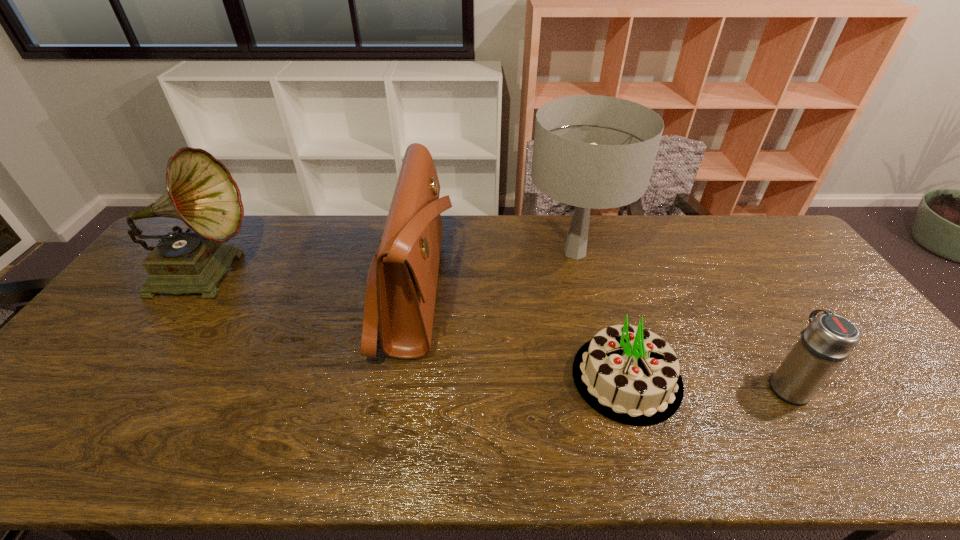
Where is `vacant area situated 0.370m with a handle on the side of the rightmost object`? This screenshot has height=540, width=960. vacant area situated 0.370m with a handle on the side of the rightmost object is located at coordinates (718, 272).

Locate an element on the screen. vacant region located 0.150m with a handle on the side of the rightmost object is located at coordinates (749, 323).

This screenshot has height=540, width=960. What are the coordinates of `free location located 0.290m on the left of the birthday cake` in the screenshot? It's located at point(457,377).

At what (x,y) coordinates should I click in order to perform the action: click on lampshade that is at the far edge. Please return your answer as a coordinate pair (x, y). Looking at the image, I should click on (593, 152).

Identify the location of record player situated at the far edge. (201, 192).

Locate an element on the screen. satchel located in the far edge section of the desktop is located at coordinates (401, 286).

Locate an element on the screen. object present at the left edge is located at coordinates (201, 192).

Locate an element on the screen. The width and height of the screenshot is (960, 540). object at the far left corner is located at coordinates point(201,192).

The image size is (960, 540). Identify the location of vacant space at the far edge of the desktop. (364, 221).

The height and width of the screenshot is (540, 960). In the image, there is a desktop. Identify the location of vacant space at the near edge. (853, 436).